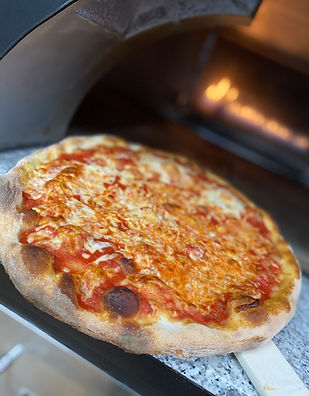
Locate all where you'd cook pizza in the image. Your answer should be formatted as a list of tuples, i.e. [(x1, y1), (x2, y2), ...], where each tuple contains the x and y coordinates of a point satisfying the conditions above.

[(228, 171)]